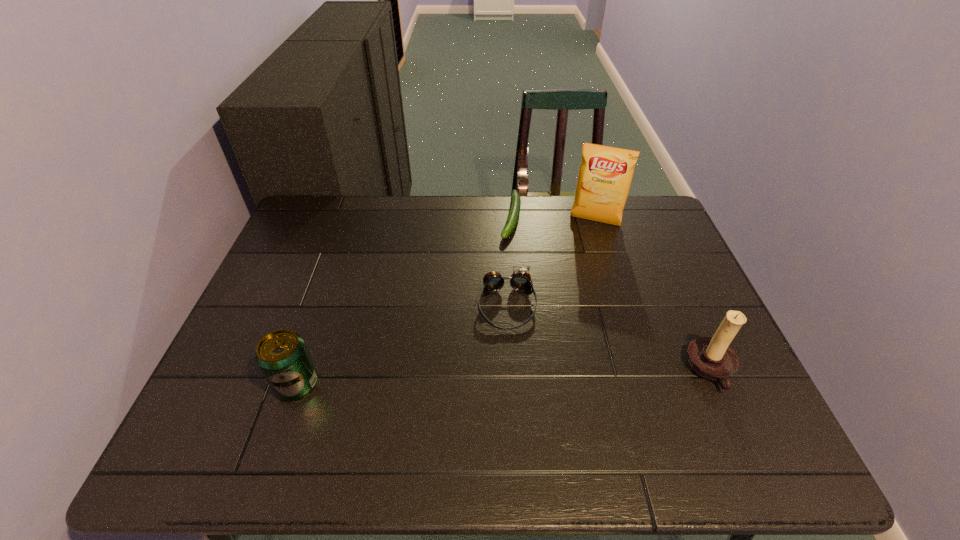
I want to click on free space that satisfies the following two spatial constraints: 1. on the front side of the third farthest object; 2. on the wick of the fourth shortest object, so click(511, 370).

You are a GUI agent. You are given a task and a screenshot of the screen. Output one action in this format:
    pyautogui.click(x=<x>, y=<y>)
    Task: Click on the blank space that satisfies the following two spatial constraints: 1. on the back side of the leftmost object; 2. on the wick of the fourth shortest object
    The height and width of the screenshot is (540, 960).
    Given the screenshot: What is the action you would take?
    pyautogui.click(x=301, y=370)

The height and width of the screenshot is (540, 960). I want to click on vacant space that satisfies the following two spatial constraints: 1. on the front side of the candle holder; 2. on the wick of the crisp (potato chip), so click(640, 370).